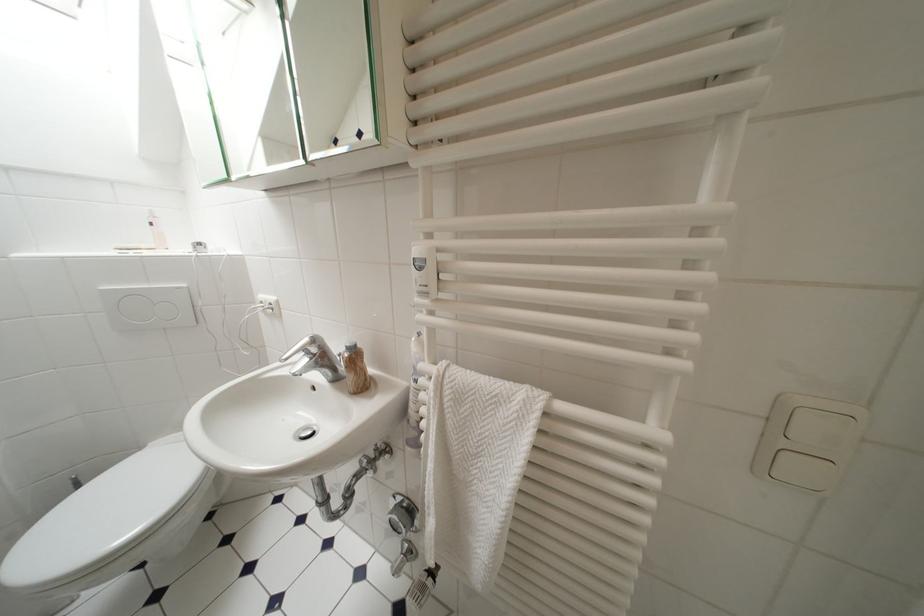
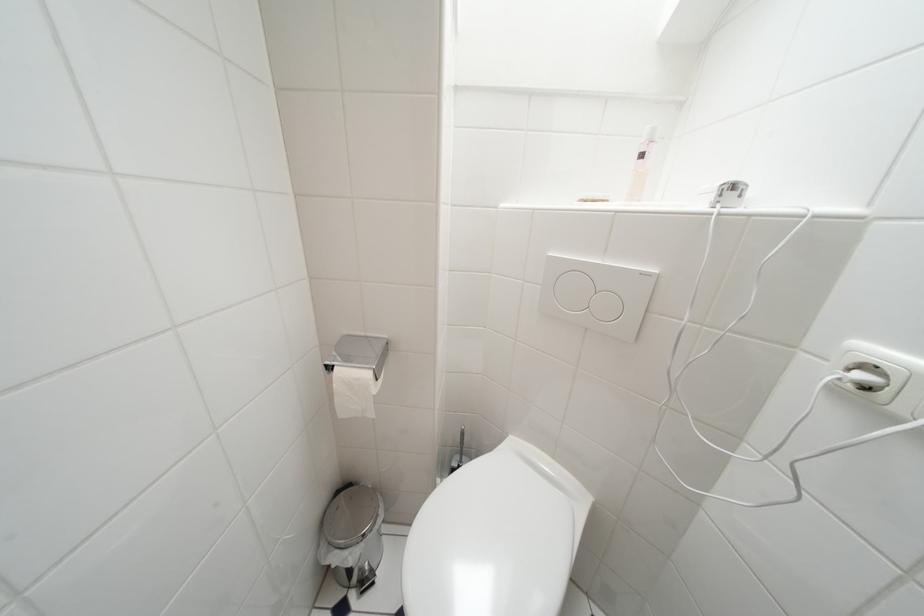
Question: The first image is from the beginning of the video and the second image is from the end. How did the camera likely rotate when shooting the video?

Choices:
 (A) Left
 (B) Right
 (C) Up
 (D) Down

Answer: (A)